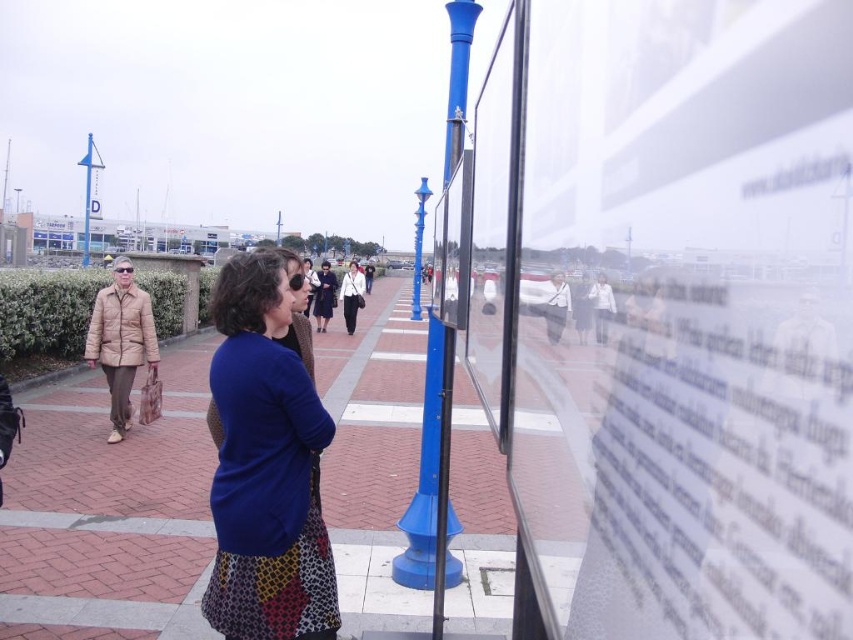
Consider the image. You are standing at the point marked by the coordinates point (265, 468). Looking around, you see the blue fabric skirt at center. What object is located exactly at your current position?

The point marked by the coordinates point (265, 468) is exactly where the blue fabric skirt at center is located.

You are a delivery person needing to navigate from the waterfront to the lamppost. The brick pavement at center and green leafy hedge at left are in your path. Which object should you walk around to reach the lamppost?

The brick pavement at center is in front of the green leafy hedge at left, so you should walk around the green leafy hedge at left to reach the lamppost.

You are standing at the point with coordinates (109, 513) in the image. What surface are you currently standing on?

The point at coordinates (109, 513) corresponds to the brick pavement at center, so you are standing on the brick pavement at center.